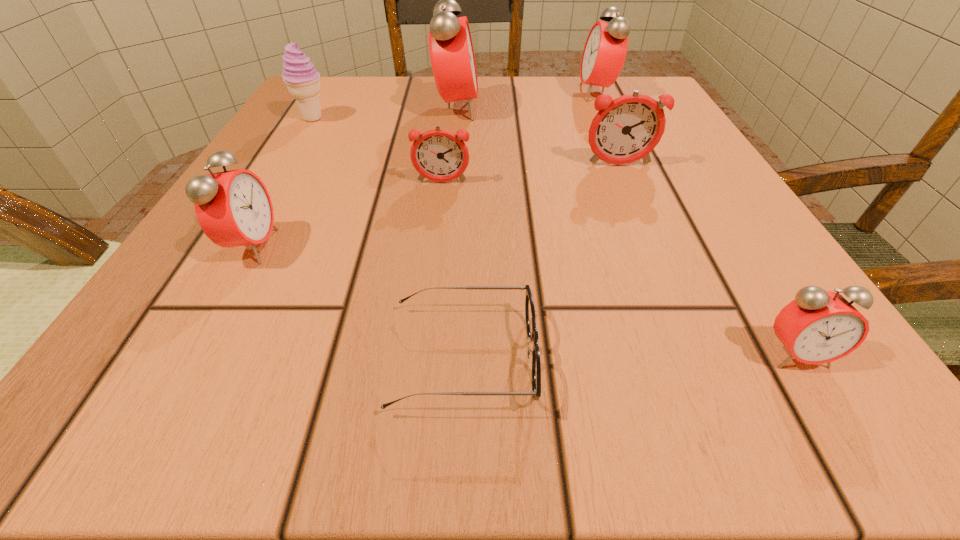
Locate an element on the screen. The image size is (960, 540). free spot that satisfies the following two spatial constraints: 1. on the front-facing side of the biggest red alarm clock; 2. on the front-facing side of the third nearest alarm clock is located at coordinates (450, 183).